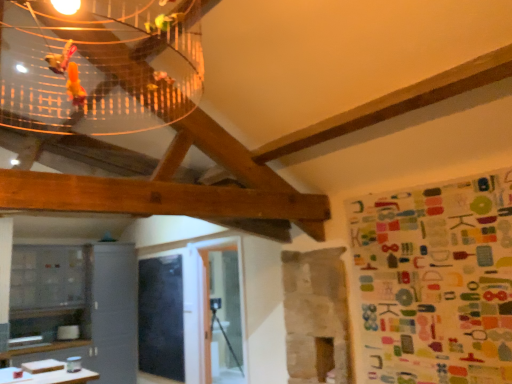
Question: From a real-world perspective, is multicolored fabric at right physically above black matte board at center?

Choices:
 (A) yes
 (B) no

Answer: (A)

Question: Is multicolored fabric at right far away from black matte board at center?

Choices:
 (A) no
 (B) yes

Answer: (B)

Question: Considering the relative sizes of multicolored fabric at right and black matte board at center in the image provided, is multicolored fabric at right shorter than black matte board at center?

Choices:
 (A) no
 (B) yes

Answer: (B)

Question: Is multicolored fabric at right bigger than black matte board at center?

Choices:
 (A) yes
 (B) no

Answer: (B)

Question: Can black matte board at center be found inside multicolored fabric at right?

Choices:
 (A) no
 (B) yes

Answer: (A)

Question: Considering the relative sizes of multicolored fabric at right and black matte board at center in the image provided, is multicolored fabric at right thinner than black matte board at center?

Choices:
 (A) yes
 (B) no

Answer: (B)

Question: From the image's perspective, is black matte board at center below multicolored fabric at right?

Choices:
 (A) yes
 (B) no

Answer: (A)

Question: Is black matte board at center behind multicolored fabric at right?

Choices:
 (A) no
 (B) yes

Answer: (B)

Question: From a real-world perspective, is black matte board at center below multicolored fabric at right?

Choices:
 (A) yes
 (B) no

Answer: (A)

Question: Is black matte board at center at the right side of multicolored fabric at right?

Choices:
 (A) no
 (B) yes

Answer: (A)

Question: Is black matte board at center at the left side of multicolored fabric at right?

Choices:
 (A) yes
 (B) no

Answer: (A)

Question: From a real-world perspective, does black matte board at center stand above multicolored fabric at right?

Choices:
 (A) yes
 (B) no

Answer: (B)

Question: Do you think black matte board at center is within multicolored fabric at right, or outside of it?

Choices:
 (A) inside
 (B) outside

Answer: (B)